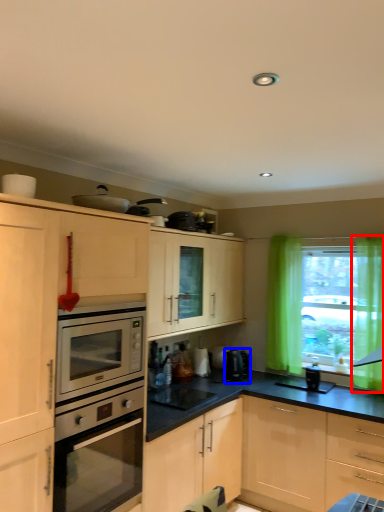
Question: Which point is further to the camera, curtain (highlighted by a red box) or coffee machine (highlighted by a blue box)?

Choices:
 (A) curtain
 (B) coffee machine

Answer: (B)